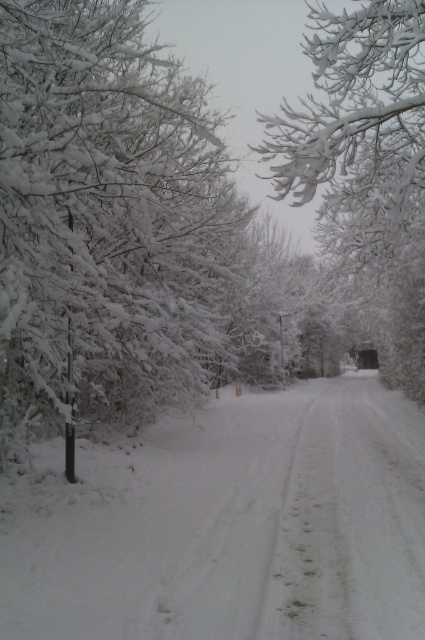
You are a hiker trying to cross the snow. You see the white fluffy snow at center and the white frosty tree at left. Which one is closer to you?

The white fluffy snow at center is closer to you because it is in front of the white frosty tree at left.